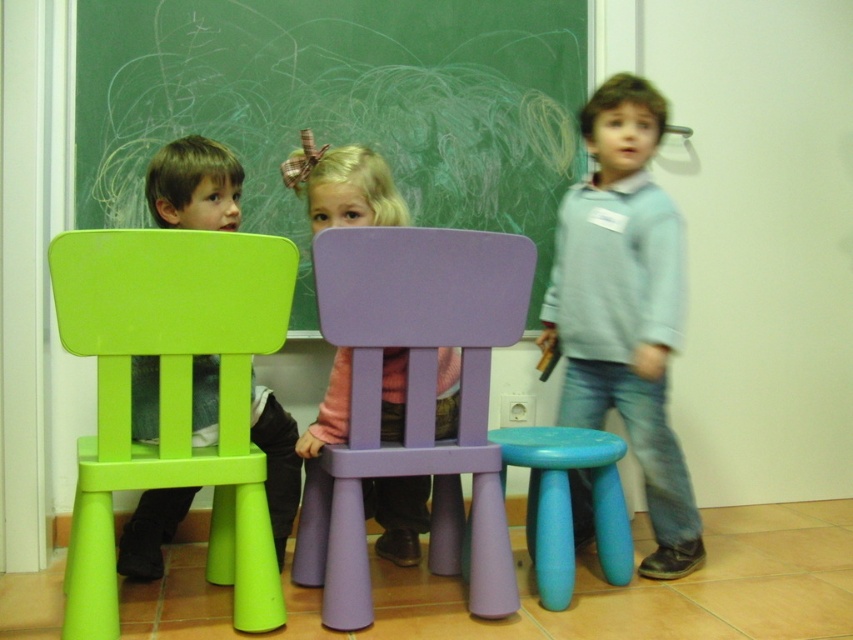
Question: Which is nearer to the pink fabric dress at center?

Choices:
 (A) matte blue stool at lower center
 (B) light blue cotton shirt at right

Answer: (A)

Question: Which object is the farthest from the pink fabric dress at center?

Choices:
 (A) matte blue stool at lower center
 (B) purple plastic chair at center

Answer: (A)

Question: Is green plastic chair at left smaller than pink fabric dress at center?

Choices:
 (A) yes
 (B) no

Answer: (B)

Question: Can you confirm if green chalkboard at upper center is positioned above matte blue stool at lower center?

Choices:
 (A) yes
 (B) no

Answer: (A)

Question: Estimate the real-world distances between objects in this image. Which object is closer to the light blue cotton shirt at right?

Choices:
 (A) pink fabric dress at center
 (B) green plastic chair at left

Answer: (A)

Question: Does green plastic chair at left come in front of light blue cotton shirt at right?

Choices:
 (A) no
 (B) yes

Answer: (B)